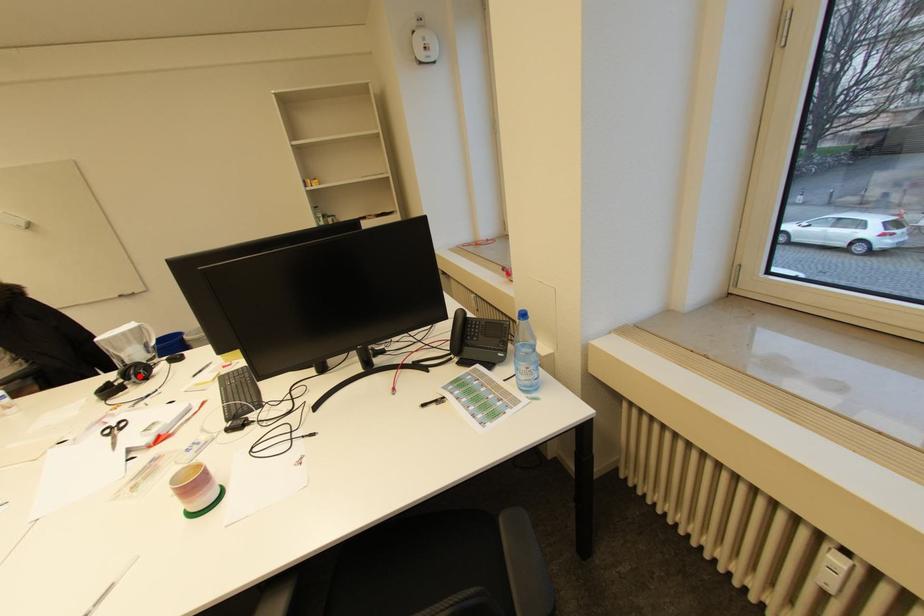
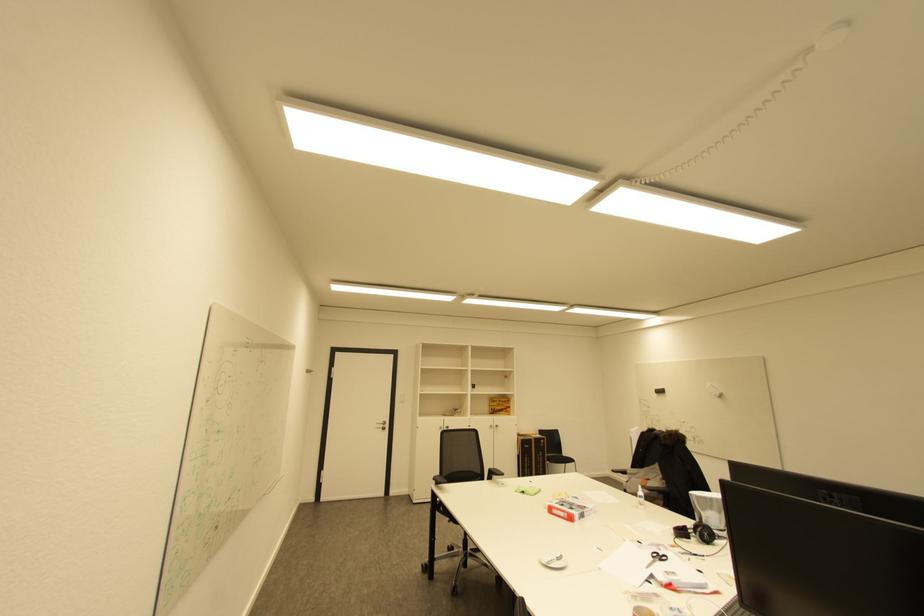
In the second image, find the point that corresponds to the highlighted location in the first image.

(704, 533)